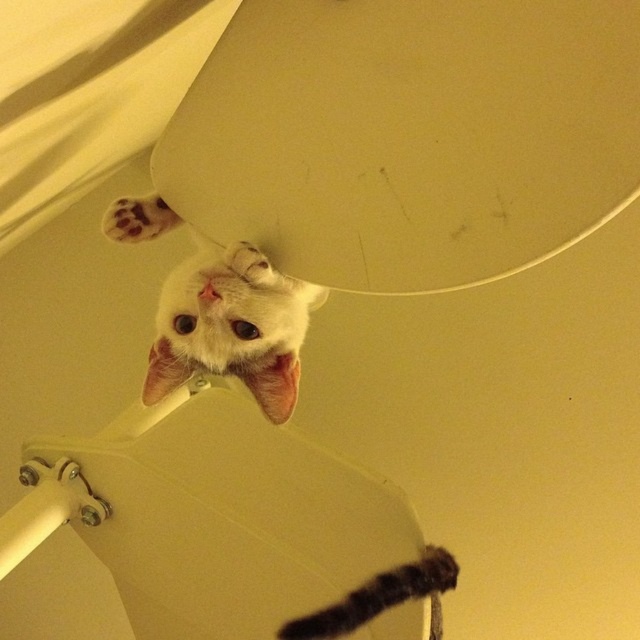
Does white fur cat at upper center appear over white fur paw at upper left?

Incorrect, white fur cat at upper center is not positioned above white fur paw at upper left.

How much distance is there between white fur cat at upper center and white fur paw at upper left?

They are 5.99 inches apart.

What do you see at coordinates (230, 326) in the screenshot?
I see `white fur cat at upper center` at bounding box center [230, 326].

What are the coordinates of `white fur cat at upper center` in the screenshot? It's located at (230, 326).